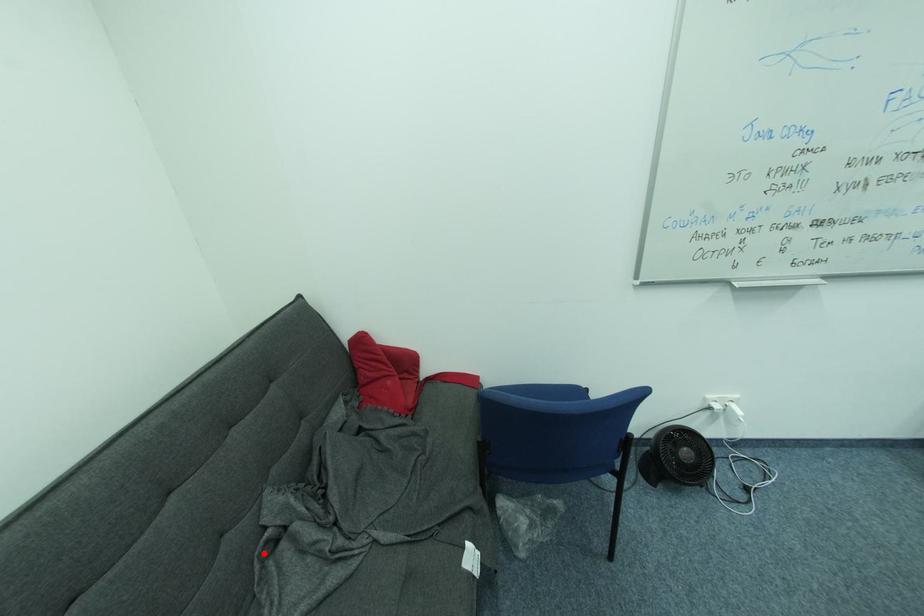
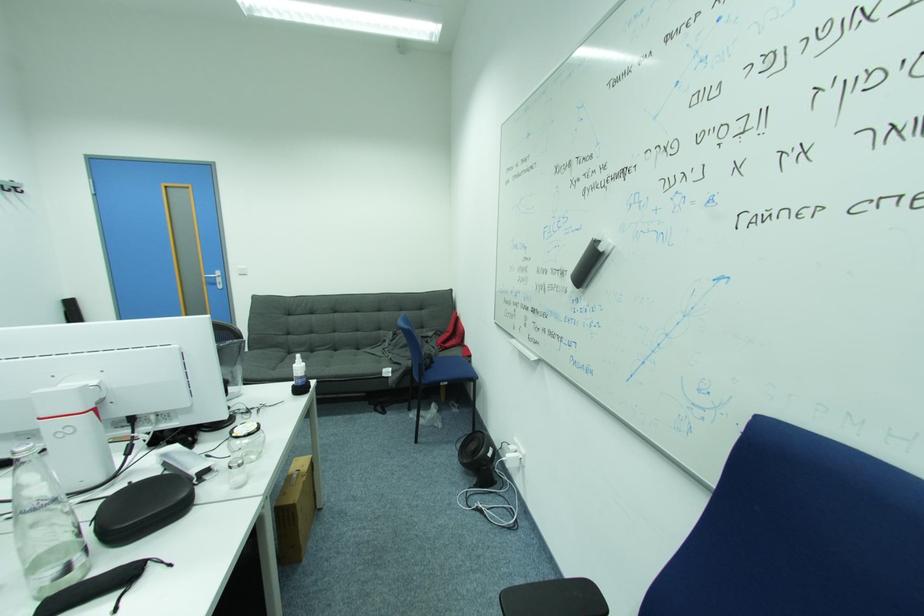
Question: A red point is marked in image1. In image2, is the corresponding 3D point closer to the camera or farther? Reply with the corresponding letter.

Choices:
 (A) The corresponding 3D point is closer.
 (B) The corresponding 3D point is farther.

Answer: (B)